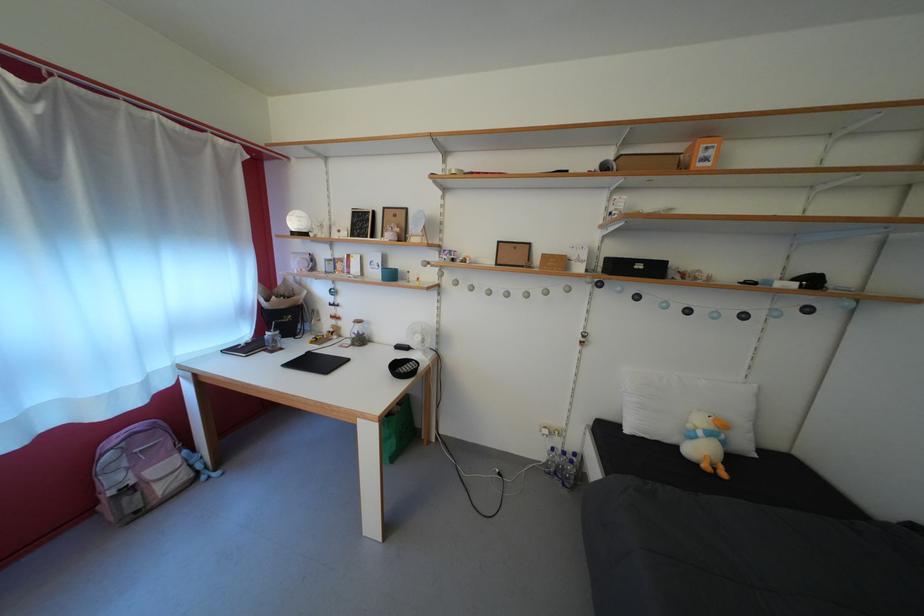
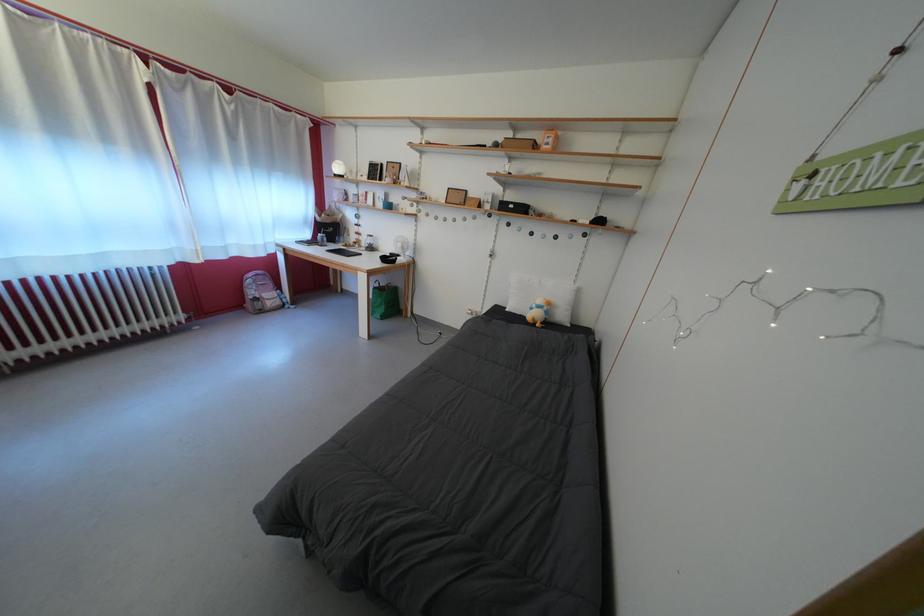
Where in the second image is the point corresponding to [342,328] from the first image?

(365, 243)